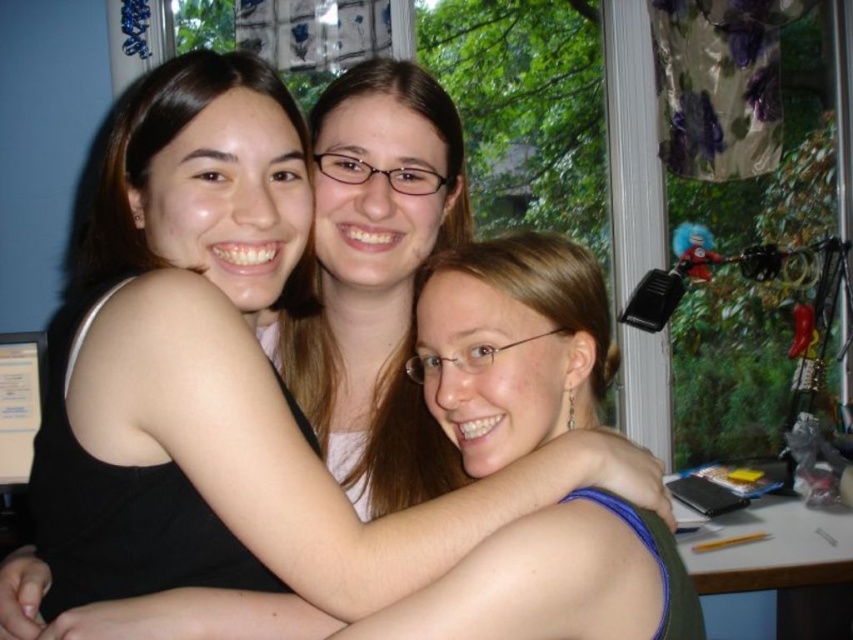
Between black matte tank top at left and wooden desk at lower right, which one appears on the left side from the viewer's perspective?

black matte tank top at left

Who is positioned more to the right, black matte tank top at left or wooden desk at lower right?

From the viewer's perspective, wooden desk at lower right appears more on the right side.

The image size is (853, 640). What are the coordinates of `black matte tank top at left` in the screenshot? It's located at (265, 358).